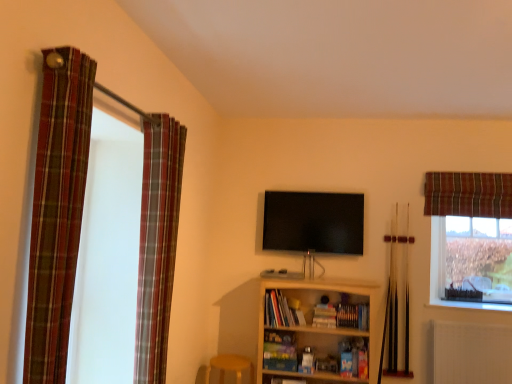
In order to face hardcover book at center, acting as the first book starting from the right, should I rotate leftwards or rightwards?

Turn right by 9.046 degrees to look at hardcover book at center, acting as the first book starting from the right.

At what (x,y) coordinates should I click in order to perform the action: click on white textured radiator at lower right. Please return your answer as a coordinate pair (x, y). Image resolution: width=512 pixels, height=384 pixels. Looking at the image, I should click on (471, 353).

Measure the distance between point [271,212] and camera.

12.86 feet.

The image size is (512, 384). What do you see at coordinates (468, 194) in the screenshot?
I see `plaid fabric curtain at upper right, arranged as the third curtain when viewed from the front` at bounding box center [468, 194].

Locate an element on the screen. light wood bookshelf at center is located at coordinates (313, 329).

Locate an element on the screen. hardcover book at center, the second book viewed from the left is located at coordinates (324, 316).

Could you tell me if hardcover book at center, the second book viewed from the left, is turned towards light wood bookshelf at center?

Yes.

Find the location of a particular element. The image size is (512, 384). book that is the 2nd one when counting backward from the light wood bookshelf at center is located at coordinates (x=324, y=316).

Can you confirm if hardcover book at center, the second book viewed from the left, is taller than light wood bookshelf at center?

No.

Is the surface of hardcover book at center, acting as the first book starting from the right, in direct contact with light wood bookshelf at center?

No, hardcover book at center, acting as the first book starting from the right, is not in contact with light wood bookshelf at center.

From the image's perspective, which is below, plaid fabric curtain at left, acting as the 3th curtain starting from the right, or white textured radiator at lower right?

white textured radiator at lower right is shown below in the image.

Is plaid fabric curtain at left, acting as the 3th curtain starting from the right, far away from white textured radiator at lower right?

Yes, plaid fabric curtain at left, acting as the 3th curtain starting from the right, and white textured radiator at lower right are located far from each other.

Considering the relative sizes of plaid fabric curtain at left, acting as the 3th curtain starting from the right, and white textured radiator at lower right in the image provided, is plaid fabric curtain at left, acting as the 3th curtain starting from the right, wider than white textured radiator at lower right?

Yes.

Considering the relative sizes of plaid fabric curtain at left, acting as the 1th curtain starting from the left, and white textured radiator at lower right in the image provided, is plaid fabric curtain at left, acting as the 1th curtain starting from the left, shorter than white textured radiator at lower right?

No, plaid fabric curtain at left, acting as the 1th curtain starting from the left, is not shorter than white textured radiator at lower right.

Is flat screen tv at center next to plaid fabric curtain at upper right, the 1th curtain when ordered from right to left?

flat screen tv at center is not next to plaid fabric curtain at upper right, the 1th curtain when ordered from right to left, and they're not touching.

From the picture: Between flat screen tv at center and plaid fabric curtain at upper right, positioned as the 1th curtain in back-to-front order, which one has smaller size?

plaid fabric curtain at upper right, positioned as the 1th curtain in back-to-front order.

Which object is further away from the camera, flat screen tv at center or plaid fabric curtain at upper right, arranged as the third curtain when viewed from the front?

Positioned behind is flat screen tv at center.

Based on the photo, considering the relative sizes of flat screen tv at center and plaid fabric curtain at upper right, the 1th curtain when ordered from right to left, in the image provided, is flat screen tv at center wider than plaid fabric curtain at upper right, the 1th curtain when ordered from right to left,?

Yes.

You are a GUI agent. You are given a task and a screenshot of the screen. Output one action in this format:
    pyautogui.click(x=<x>, y=<y>)
    Task: Click on the shelf in front of the hardcover books at center, which is the 1th book in left-to-right order
    This screenshot has height=384, width=512.
    Given the screenshot: What is the action you would take?
    pyautogui.click(x=313, y=329)

Is light wood bookshelf at center aimed at hardcover books at center, which is the 1th book in left-to-right order?

Yes, light wood bookshelf at center is oriented towards hardcover books at center, which is the 1th book in left-to-right order.

Is light wood bookshelf at center thinner than hardcover books at center, which is the 1th book in left-to-right order?

Incorrect, the width of light wood bookshelf at center is not less than that of hardcover books at center, which is the 1th book in left-to-right order.

Looking at the image, does light wood bookshelf at center seem bigger or smaller compared to hardcover books at center, the second book viewed from the right?

Clearly, light wood bookshelf at center is larger in size than hardcover books at center, the second book viewed from the right.

Measure the distance from hardcover books at center, which is the 1th book in left-to-right order, to hardcover book at center, the second book viewed from the left.

They are 11.27 inches apart.

Consider the image. Considering the sizes of hardcover books at center, the second book viewed from the right, and hardcover book at center, the second book viewed from the left, in the image, is hardcover books at center, the second book viewed from the right, bigger or smaller than hardcover book at center, the second book viewed from the left,?

hardcover books at center, the second book viewed from the right, is bigger than hardcover book at center, the second book viewed from the left.

From the image's perspective, which object appears higher, hardcover books at center, the second book viewed from the right, or hardcover book at center, the second book viewed from the left?

From the image's view, hardcover books at center, the second book viewed from the right, is above.

Consider the image. Is hardcover books at center, which is the 1th book in left-to-right order, not inside hardcover book at center, acting as the first book starting from the right?

Indeed, hardcover books at center, which is the 1th book in left-to-right order, is completely outside hardcover book at center, acting as the first book starting from the right.

Is plaid fabric curtain at upper right, the 1th curtain when ordered from right to left, looking in the opposite direction of hardcover books at center, the second book viewed from the right?

No, plaid fabric curtain at upper right, the 1th curtain when ordered from right to left,'s orientation is not away from hardcover books at center, the second book viewed from the right.

At what (x,y) coordinates should I click in order to perform the action: click on the 2nd book counting from the left side of the plaid fabric curtain at upper right, marked as the 3th curtain in a left-to-right arrangement. Please return your answer as a coordinate pair (x, y). Looking at the image, I should click on (281, 311).

Considering the sizes of objects plaid fabric curtain at upper right, the 1th curtain when ordered from right to left, and hardcover books at center, which is the 1th book in left-to-right order, in the image provided, who is thinner, plaid fabric curtain at upper right, the 1th curtain when ordered from right to left, or hardcover books at center, which is the 1th book in left-to-right order,?

With smaller width is plaid fabric curtain at upper right, the 1th curtain when ordered from right to left.

Between plaid fabric curtain at upper right, the 1th curtain when ordered from right to left, and hardcover books at center, which is the 1th book in left-to-right order, which one has smaller size?

hardcover books at center, which is the 1th book in left-to-right order.

Considering the sizes of objects plaid fabric curtain at left, the second curtain when ordered from left to right, and plaid fabric curtain at left, which is the 3th curtain in back-to-front order, in the image provided, who is smaller, plaid fabric curtain at left, the second curtain when ordered from left to right, or plaid fabric curtain at left, which is the 3th curtain in back-to-front order,?

plaid fabric curtain at left, which is the 3th curtain in back-to-front order.

Where is `curtain located in front of the plaid fabric curtain at left, positioned as the second curtain in front-to-back order`? curtain located in front of the plaid fabric curtain at left, positioned as the second curtain in front-to-back order is located at coordinates (57, 210).

From the picture: How different are the orientations of plaid fabric curtain at left, positioned as the second curtain in front-to-back order, and plaid fabric curtain at left, acting as the 3th curtain starting from the right, in degrees?

The angular difference between plaid fabric curtain at left, positioned as the second curtain in front-to-back order, and plaid fabric curtain at left, acting as the 3th curtain starting from the right, is 0.000975 degrees.

Which is behind, point (151, 258) or point (77, 114)?

Point (151, 258)

The height and width of the screenshot is (384, 512). Find the location of `shelf that is on the left side of hardcover book at center, acting as the first book starting from the right`. shelf that is on the left side of hardcover book at center, acting as the first book starting from the right is located at coordinates (313, 329).

Where is `radiator below the plaid fabric curtain at left, which is the 1th curtain from front to back (from the image's perspective)`? This screenshot has height=384, width=512. radiator below the plaid fabric curtain at left, which is the 1th curtain from front to back (from the image's perspective) is located at coordinates (471, 353).

Which object lies further to the anchor point hardcover books at center, which is the 1th book in left-to-right order, plaid fabric curtain at left, which appears as the 2th curtain when viewed from the right, or flat screen tv at center?

plaid fabric curtain at left, which appears as the 2th curtain when viewed from the right, lies further to hardcover books at center, which is the 1th book in left-to-right order, than the other object.

Looking at the image, which one is located closer to plaid fabric curtain at left, positioned as the second curtain in front-to-back order, clear glass window at upper right or white textured radiator at lower right?

white textured radiator at lower right lies closer to plaid fabric curtain at left, positioned as the second curtain in front-to-back order, than the other object.

From the image, which object appears to be nearer to white textured radiator at lower right, light wood bookshelf at center or plaid fabric curtain at upper right, positioned as the 1th curtain in back-to-front order?

The object closer to white textured radiator at lower right is light wood bookshelf at center.

When comparing their distances from plaid fabric curtain at left, acting as the 1th curtain starting from the left, does flat screen tv at center or hardcover book at center, the second book viewed from the left, seem closer?

flat screen tv at center is positioned closer to the anchor plaid fabric curtain at left, acting as the 1th curtain starting from the left.

Looking at the image, which one is located closer to hardcover book at center, the second book viewed from the left, plaid fabric curtain at left, which is counted as the second curtain, starting from the back, or plaid fabric curtain at left, acting as the 3th curtain starting from the right?

Based on the image, plaid fabric curtain at left, which is counted as the second curtain, starting from the back, appears to be nearer to hardcover book at center, the second book viewed from the left.

Consider the image. Estimate the real-world distances between objects in this image. Which object is further from hardcover books at center, the second book viewed from the right, clear glass window at upper right or white textured radiator at lower right?

clear glass window at upper right lies further to hardcover books at center, the second book viewed from the right, than the other object.

Based on their spatial positions, is plaid fabric curtain at upper right, arranged as the third curtain when viewed from the front, or hardcover books at center, the second book viewed from the right, closer to flat screen tv at center?

hardcover books at center, the second book viewed from the right, lies closer to flat screen tv at center than the other object.

When comparing their distances from hardcover books at center, which is the 1th book in left-to-right order, does plaid fabric curtain at upper right, marked as the 3th curtain in a left-to-right arrangement, or hardcover book at center, the second book viewed from the left, seem further?

Based on the image, plaid fabric curtain at upper right, marked as the 3th curtain in a left-to-right arrangement, appears to be further to hardcover books at center, which is the 1th book in left-to-right order.

I want to click on book between light brown wooden stool at lower left and light wood bookshelf at center in the horizontal direction, so click(x=281, y=311).

What are the coordinates of `curtain between light brown wooden stool at lower left and clear glass window at upper right in the horizontal direction` in the screenshot? It's located at (468, 194).

The height and width of the screenshot is (384, 512). I want to click on book between flat screen tv at center and plaid fabric curtain at upper right, marked as the 3th curtain in a left-to-right arrangement, so click(x=324, y=316).

What are the coordinates of `bar stool between plaid fabric curtain at left, acting as the 3th curtain starting from the right, and white textured radiator at lower right` in the screenshot? It's located at (230, 367).